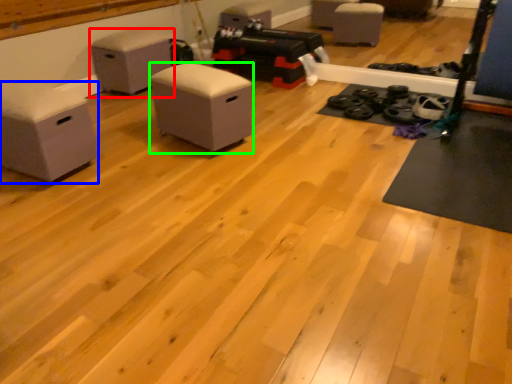
Question: Which object is positioned farthest from furniture (highlighted by a red box)? Select from furniture (highlighted by a blue box) and furniture (highlighted by a green box).

Choices:
 (A) furniture
 (B) furniture

Answer: (A)